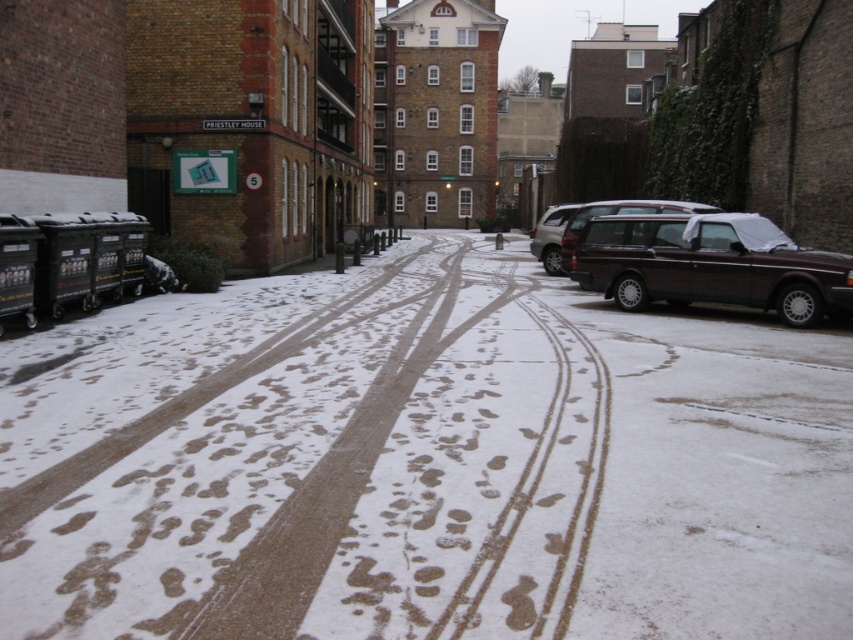
Question: Estimate the real-world distances between objects in this image. Which object is farther from the dark brown matte suv at right?

Choices:
 (A) white snow at center
 (B) maroon metallic station wagon at right

Answer: (A)

Question: Estimate the real-world distances between objects in this image. Which object is farther from the maroon metallic station wagon at right?

Choices:
 (A) dark brown matte suv at right
 (B) white snow at center

Answer: (A)

Question: Which of the following is the farthest from the observer?

Choices:
 (A) (561, 227)
 (B) (718, 259)
 (C) (769, 332)

Answer: (A)

Question: Where is white snow at center located in relation to maroon metallic station wagon at right in the image?

Choices:
 (A) below
 (B) above

Answer: (A)

Question: Is white snow at center above maroon metallic station wagon at right?

Choices:
 (A) no
 (B) yes

Answer: (A)

Question: Can you confirm if white snow at center is thinner than maroon metallic station wagon at right?

Choices:
 (A) yes
 (B) no

Answer: (B)